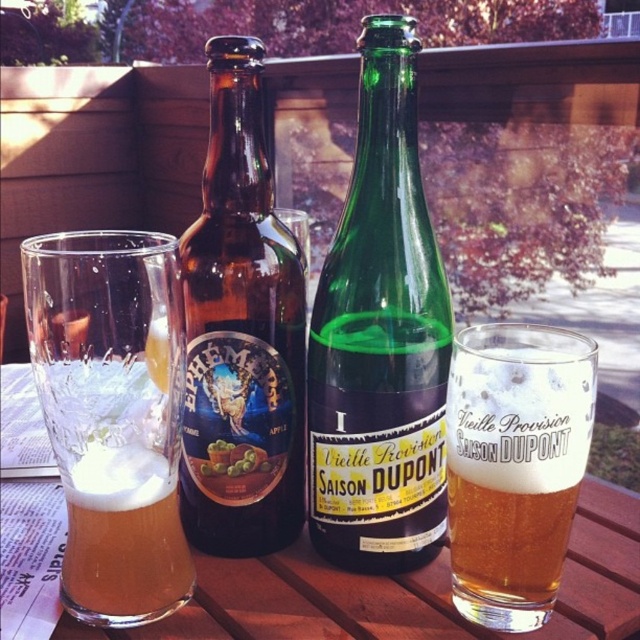
You are a bartender and need to place a coaster under the clear glass mug at left. Where should you place the coaster relative to the mug?

The coaster should be placed directly under the clear glass mug at left at point (x=113, y=416).

You are a bartender setting up a table for a small gathering. You have a narrow bottle of wine that is 2 inches in diameter. You want to place it on the brown wooden picnic table at center. Can the brown glass bottle at center fit on the table without falling over?

The brown glass bottle at center is thinner than the brown wooden picnic table at center, so it should fit without issue. However, the stability depends on the table surface. Since the bottle is thinner than the table, it won

You are at a picnic and want to pour a drink into the taller container. Which one should you choose between the clear glass mug at left and the foamy glass at center?

The clear glass mug at left is much taller than the foamy glass at center, so you should choose the clear glass mug at left to pour your drink into.